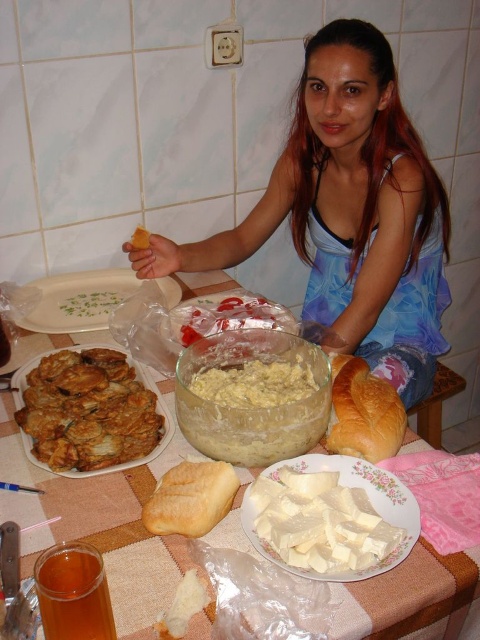
Question: Is white glossy plate at upper left smaller than golden crusty bread at lower right?

Choices:
 (A) yes
 (B) no

Answer: (B)

Question: Estimate the real-world distances between objects in this image. Which object is farther from the golden soft bread at center?

Choices:
 (A) golden crispy fried at left
 (B) white glossy plate at upper left
 (C) blue fabric dress at center
 (D) white creamy dip at center

Answer: (C)

Question: Among these objects, which one is nearest to the camera?

Choices:
 (A) white glossy platter at center
 (B) white creamy dip at center
 (C) golden crusty bread at lower right
 (D) white matte cheese at center

Answer: (D)

Question: Which of the following is the closest to the observer?

Choices:
 (A) 191,449
 (B) 100,291
 (C) 235,481

Answer: (C)

Question: Does blue fabric dress at center have a smaller size compared to white glossy plate at upper left?

Choices:
 (A) no
 (B) yes

Answer: (A)

Question: Is blue fabric dress at center to the left of golden crusty bread at lower right from the viewer's perspective?

Choices:
 (A) no
 (B) yes

Answer: (B)